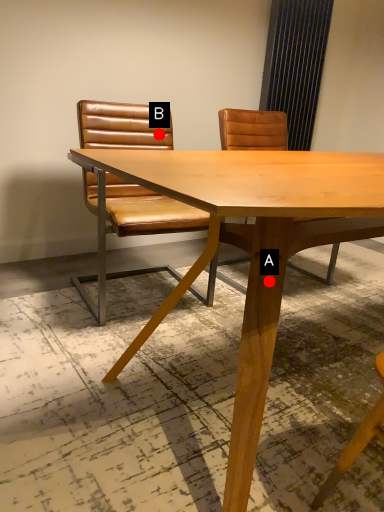
Question: Two points are circled on the image, labeled by A and B beside each circle. Which of the following is the farthest from the observer?

Choices:
 (A) A is further
 (B) B is further

Answer: (B)